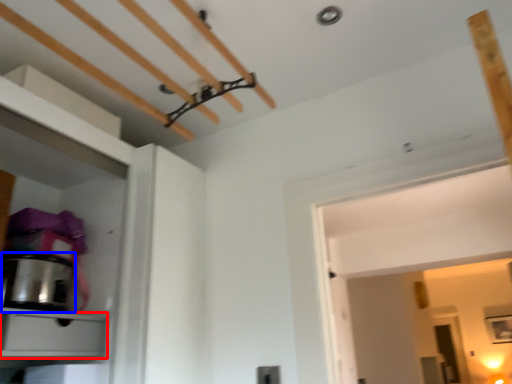
Question: Among these objects, which one is nearest to the camera, drawer (highlighted by a red box) or appliance (highlighted by a blue box)?

Choices:
 (A) drawer
 (B) appliance

Answer: (A)